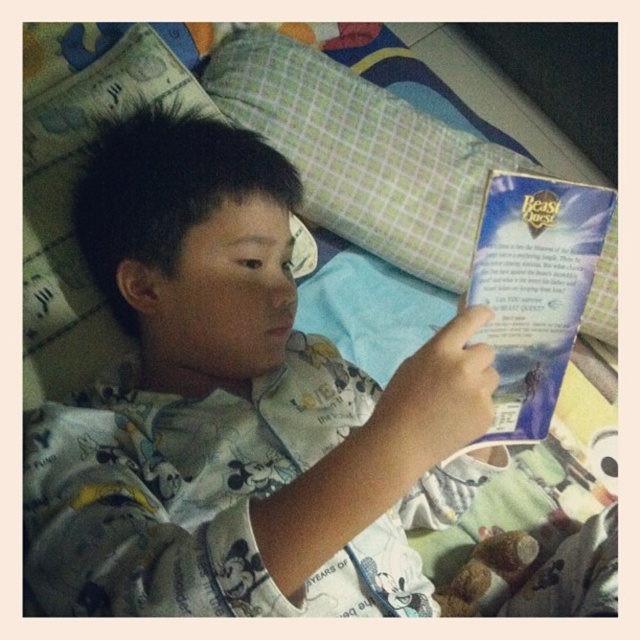
Is white cotton pajamas at center in front of green checkered pillow at upper center?

Yes, white cotton pajamas at center is in front of green checkered pillow at upper center.

What do you see at coordinates (236, 410) in the screenshot? I see `white cotton pajamas at center` at bounding box center [236, 410].

Which is in front, point (292, 371) or point (216, 76)?

Point (292, 371) is in front.

Locate an element on the screen. This screenshot has height=640, width=640. white cotton pajamas at center is located at coordinates pos(236,410).

Is white cotton pajamas at center smaller than blue paper at upper right?

Incorrect, white cotton pajamas at center is not smaller in size than blue paper at upper right.

Does white cotton pajamas at center have a greater width compared to blue paper at upper right?

Yes, white cotton pajamas at center is wider than blue paper at upper right.

Is point (168, 296) positioned after point (611, 209)?

That is True.

This screenshot has width=640, height=640. Identify the location of white cotton pajamas at center. tap(236, 410).

How far apart are green checkered pillow at upper center and blue paper at upper right?

The distance of green checkered pillow at upper center from blue paper at upper right is 25.12 inches.

The image size is (640, 640). Identify the location of green checkered pillow at upper center. (362, 154).

In order to click on green checkered pillow at upper center in this screenshot , I will do `click(362, 154)`.

Locate an element on the screen. The image size is (640, 640). green checkered pillow at upper center is located at coordinates (362, 154).